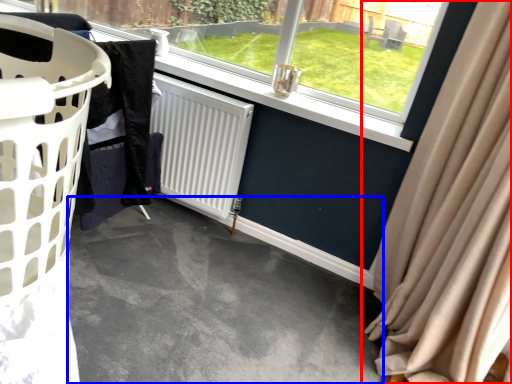
Question: Which object is further to the camera taking this photo, curtain (highlighted by a red box) or concrete (highlighted by a blue box)?

Choices:
 (A) curtain
 (B) concrete

Answer: (B)